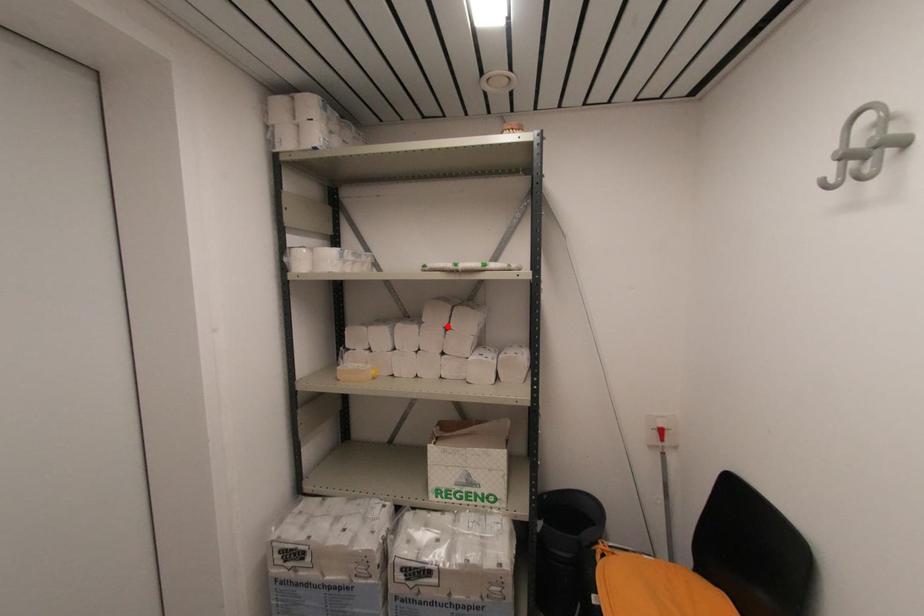
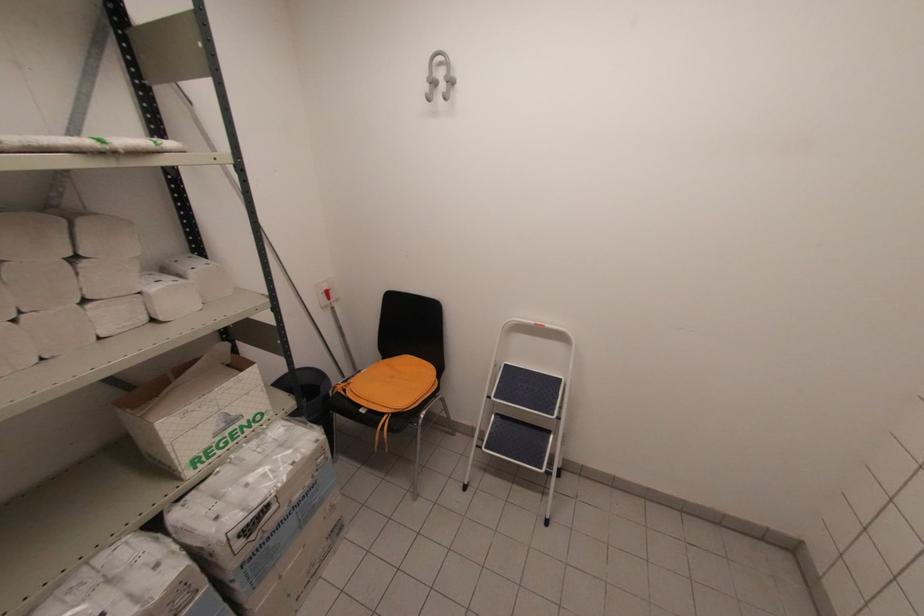
Where in the second image is the point corresponding to the highlighted location from the first image?

(71, 254)